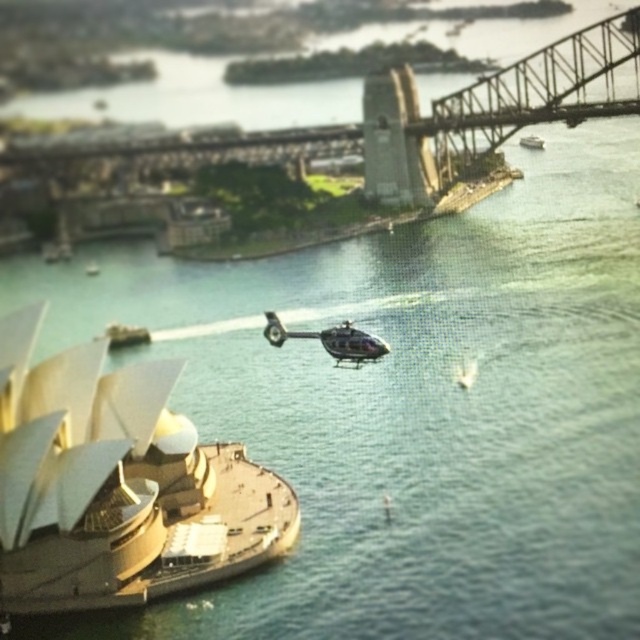
You are a drone operator planning to fly a drone between the shiny silver boat at center and the white plastic boat at upper right. The drone has a maximum flight distance of 100 meters. Can you safely fly the drone from one boat to the other without exceeding its range?

The distance between the shiny silver boat at center and the white plastic boat at upper right is 92.03 meters. Since the drone can fly up to 100 meters, it can safely make the trip between the two boats without exceeding its range.

You are a photographer planning to capture a photo of the Sydney Opera House from the water. You have access to both the metallic helicopter at center and the metallic silver boat at lower left. Which vehicle would allow you to get closer to the Opera House without obstructing the view of its iconic architecture?

The metallic silver boat at lower left would allow you to get closer to the Sydney Opera House without obstructing the view, as it is smaller than the metallic helicopter at center and can navigate closer to the shore where the Opera House is located.

Looking at this image, you are a drone operator planning to fly a drone from the camera position to the point at coordinates point (346, 355). What is the approximate distance you need to cover?

The distance between the camera and point (346, 355) is 510.07 feet, so you need to cover approximately 510.07 feet.